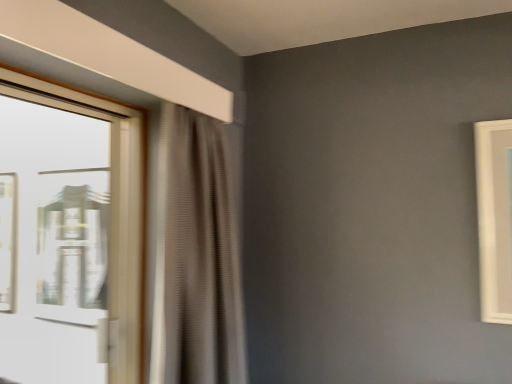
Question: From the image's perspective, is beige textured curtain at left positioned above or below clear glass window at left?

Choices:
 (A) above
 (B) below

Answer: (B)

Question: Is beige textured curtain at left situated inside clear glass window at left or outside?

Choices:
 (A) outside
 (B) inside

Answer: (A)

Question: Is beige textured curtain at left in front of or behind clear glass window at left in the image?

Choices:
 (A) behind
 (B) front

Answer: (A)

Question: From a real-world perspective, is clear glass window at left above or below beige textured curtain at left?

Choices:
 (A) below
 (B) above

Answer: (B)

Question: Is clear glass window at left situated inside beige textured curtain at left or outside?

Choices:
 (A) outside
 (B) inside

Answer: (A)

Question: Considering the positions of clear glass window at left and beige textured curtain at left in the image, is clear glass window at left wider or thinner than beige textured curtain at left?

Choices:
 (A) wide
 (B) thin

Answer: (B)

Question: Considering their positions, is clear glass window at left located in front of or behind beige textured curtain at left?

Choices:
 (A) behind
 (B) front

Answer: (B)